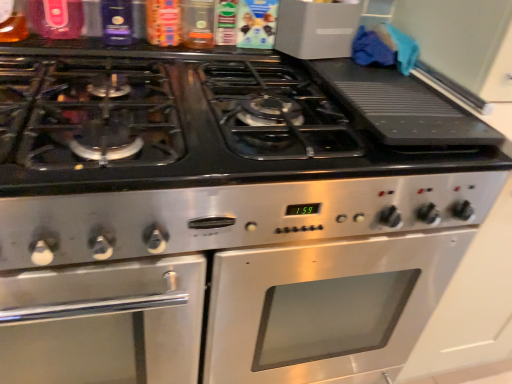
Question: Should I look upward or downward to see stainless steel oven at center?

Choices:
 (A) down
 (B) up

Answer: (A)

Question: Is there a large distance between stainless steel oven at center and stainless steel gas stove at center?

Choices:
 (A) no
 (B) yes

Answer: (A)

Question: Does stainless steel oven at center have a lesser width compared to stainless steel gas stove at center?

Choices:
 (A) yes
 (B) no

Answer: (A)

Question: From the image's perspective, does stainless steel oven at center appear lower than stainless steel gas stove at center?

Choices:
 (A) no
 (B) yes

Answer: (B)

Question: Is stainless steel oven at center further to the viewer compared to stainless steel gas stove at center?

Choices:
 (A) yes
 (B) no

Answer: (A)

Question: Is stainless steel oven at center bigger than stainless steel gas stove at center?

Choices:
 (A) no
 (B) yes

Answer: (B)

Question: Is stainless steel oven at center to the right of stainless steel gas stove at center from the viewer's perspective?

Choices:
 (A) no
 (B) yes

Answer: (A)

Question: Is stainless steel gas stove at center positioned before stainless steel oven at center?

Choices:
 (A) yes
 (B) no

Answer: (A)

Question: Considering the relative sizes of stainless steel gas stove at center and stainless steel oven at center in the image provided, is stainless steel gas stove at center thinner than stainless steel oven at center?

Choices:
 (A) yes
 (B) no

Answer: (B)

Question: Can you confirm if stainless steel gas stove at center is wider than stainless steel oven at center?

Choices:
 (A) yes
 (B) no

Answer: (A)

Question: From a real-world perspective, is stainless steel gas stove at center on stainless steel oven at center?

Choices:
 (A) yes
 (B) no

Answer: (A)

Question: Is stainless steel gas stove at center at the left side of stainless steel oven at center?

Choices:
 (A) yes
 (B) no

Answer: (B)

Question: From the image's perspective, is stainless steel gas stove at center on top of stainless steel oven at center?

Choices:
 (A) no
 (B) yes

Answer: (B)

Question: Is stainless steel gas stove at center spatially inside stainless steel oven at center, or outside of it?

Choices:
 (A) inside
 (B) outside

Answer: (B)